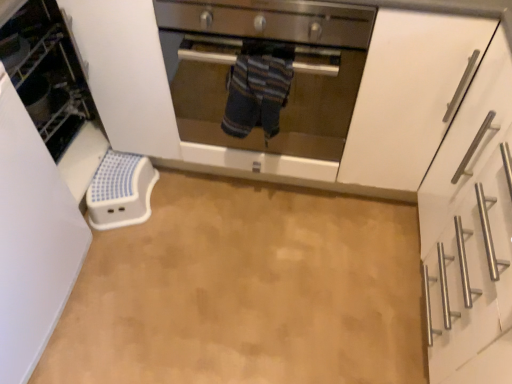
Locate an element on the screen. This screenshot has width=512, height=384. free space above beige vinyl floor at center (from a real-world perspective) is located at coordinates 239,282.